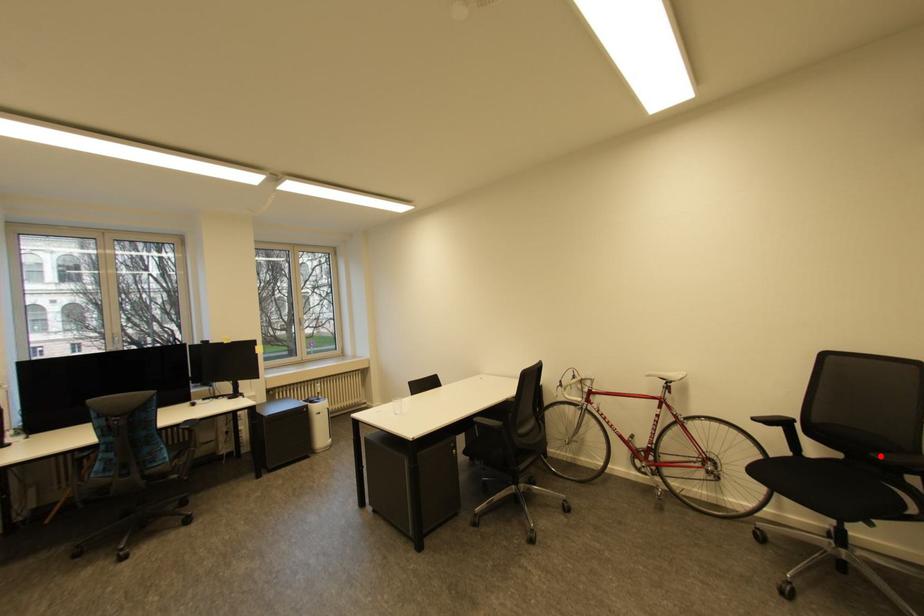
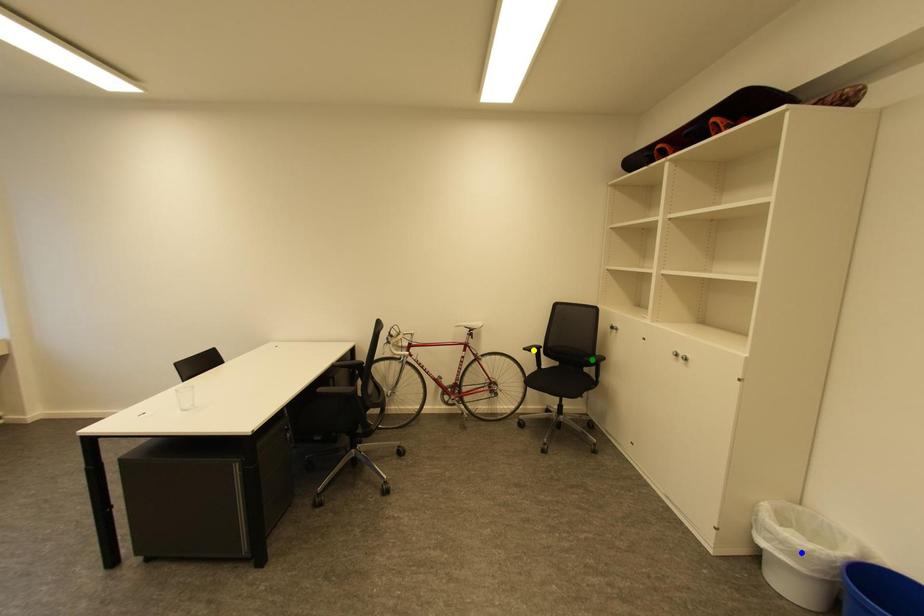
Question: I am providing you with two images of the same scene from different viewpoints. A red point is marked on the first image. You are given multiple points on the second image. Which point in image 2 represents the same 3d spot as the red point in image 1?

Choices:
 (A) blue point
 (B) yellow point
 (C) green point

Answer: (C)